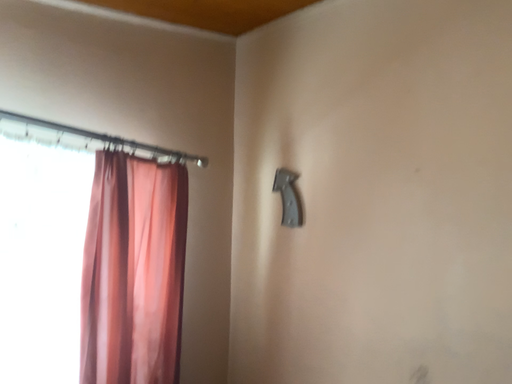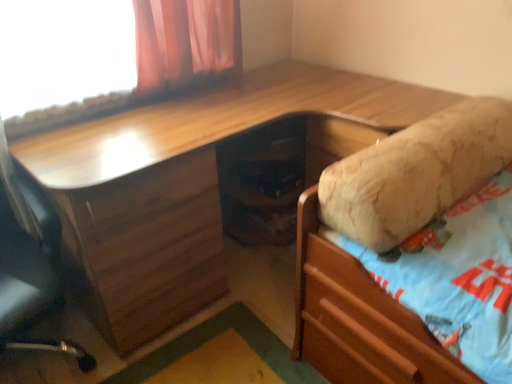
Question: Which way did the camera rotate in the video?

Choices:
 (A) rotated upward
 (B) rotated downward

Answer: (B)